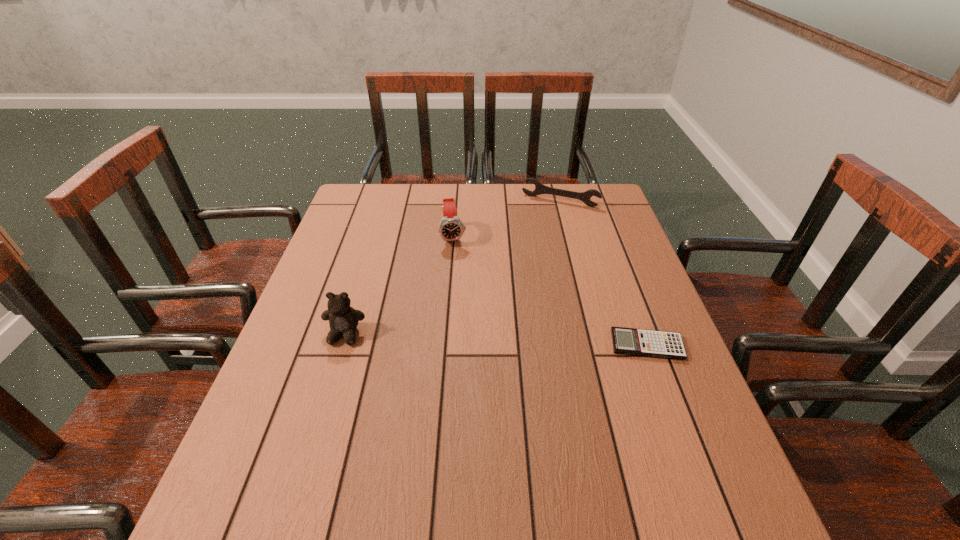
Identify the location of empty location between the calculator and the teddy bear. (495, 340).

Where is `vacant area that lies between the leftmost object and the shortest object`? This screenshot has width=960, height=540. vacant area that lies between the leftmost object and the shortest object is located at coordinates (495, 340).

Identify the location of empty space that is in between the calculator and the third nearest object. (550, 291).

This screenshot has width=960, height=540. What are the coordinates of `free space between the wrench and the watch` in the screenshot? It's located at (507, 219).

Locate which object is the second closest to the teddy bear. Please provide its 2D coordinates. Your answer should be formatted as a tuple, i.e. [(x, y)], where the tuple contains the x and y coordinates of a point satisfying the conditions above.

[(658, 344)]

Select which object is the closest to the watch. Please provide its 2D coordinates. Your answer should be formatted as a tuple, i.e. [(x, y)], where the tuple contains the x and y coordinates of a point satisfying the conditions above.

[(585, 197)]

Find the location of a particular element. The image size is (960, 540). vacant space that satisfies the following two spatial constraints: 1. on the back side of the watch; 2. on the right side of the farthest object is located at coordinates pyautogui.click(x=457, y=201).

Locate an element on the screen. The width and height of the screenshot is (960, 540). vacant space that satisfies the following two spatial constraints: 1. on the front side of the wrench; 2. on the left side of the calculator is located at coordinates (597, 345).

Where is `vacant position in the image that satisfies the following two spatial constraints: 1. on the front side of the wrench; 2. on the left side of the calculator`? Image resolution: width=960 pixels, height=540 pixels. vacant position in the image that satisfies the following two spatial constraints: 1. on the front side of the wrench; 2. on the left side of the calculator is located at coordinates (597, 345).